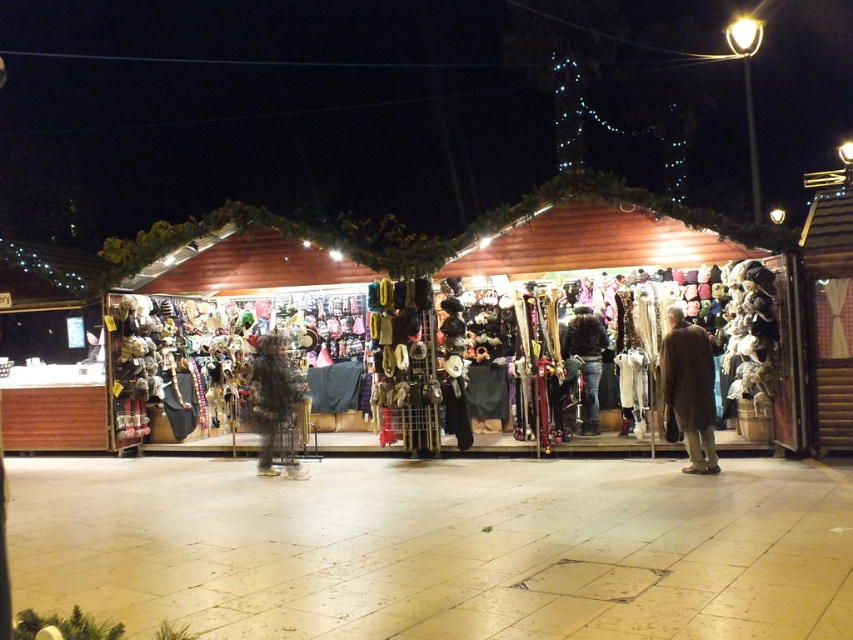
You are standing at the entrance of the market stall and see the brown wool coat at right. If you want to reach the coat quickly, should you walk straight ahead or turn to the right?

You should walk straight ahead because the brown wool coat at right is positioned in front of you, not to the side. The distance from the viewer is 8.63 meters, indicating it is directly ahead rather than requiring a turn.

Based on the photo, you are a customer at the market stall and want to try on both the brown wool coat at right and the fuzzy fabric coat at center. If you are currently standing at the center of the stall, which coat should you walk towards first to minimize the distance walked?

The fuzzy fabric coat at center is closer to your current position at the center of the stall, so you should walk towards the fuzzy fabric coat at center first to minimize the distance walked.

You are a customer at the market stall and want to try on both the brown wool coat at right and the dark brown leather jacket at center. Which one do you think will require more space to hang on a hanger?

The brown wool coat at right has a larger width than the dark brown leather jacket at center, so it will require more space to hang on a hanger.